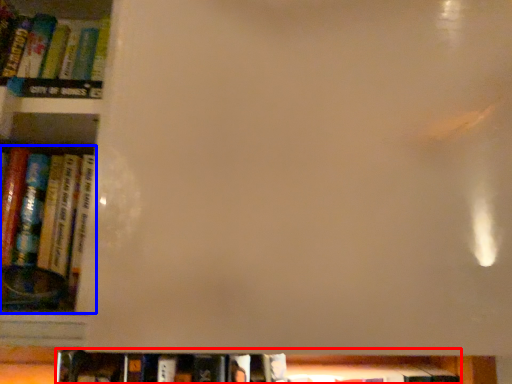
Question: Which point is closer to the camera, book (highlighted by a red box) or book (highlighted by a blue box)?

Choices:
 (A) book
 (B) book

Answer: (B)